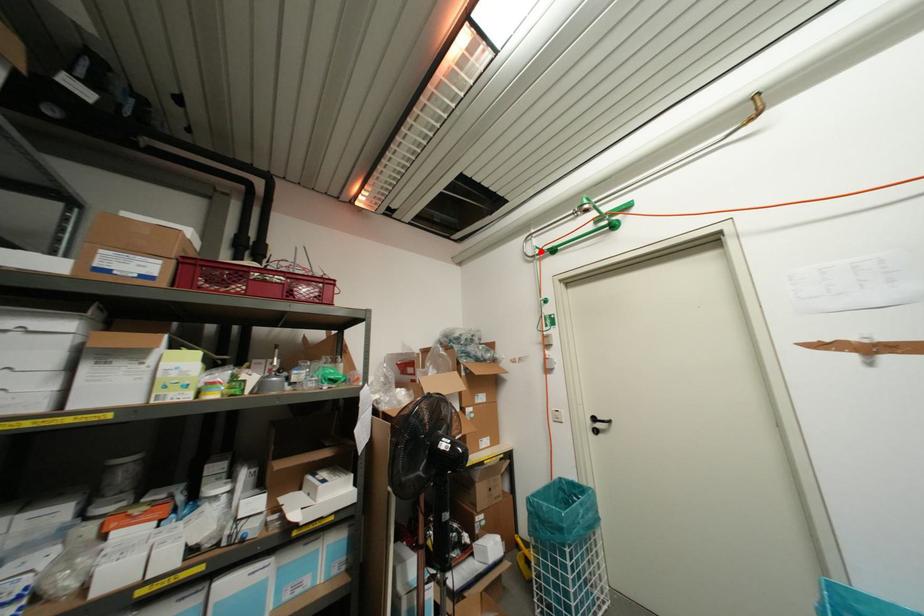
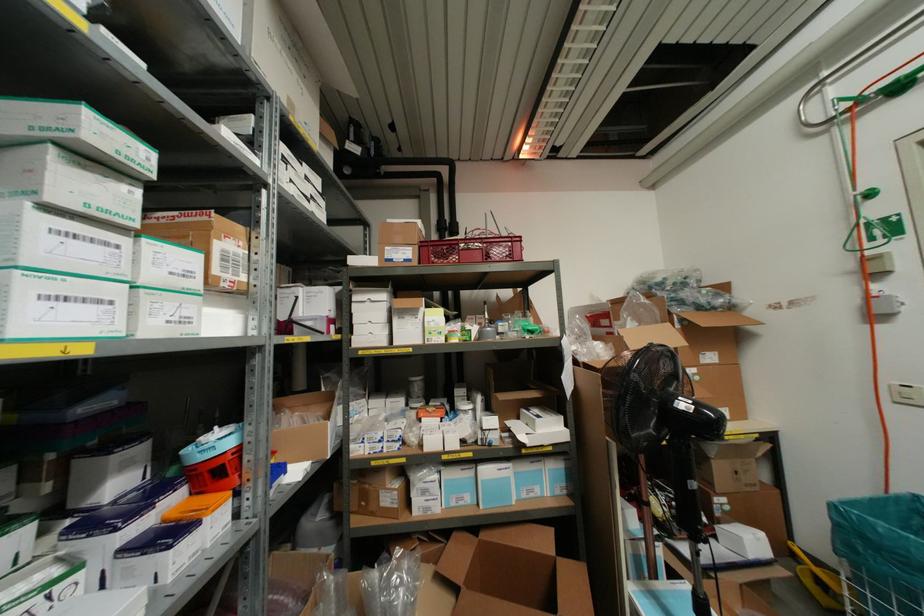
In the second image, find the point that corresponds to the highlighted location in the first image.

(859, 100)